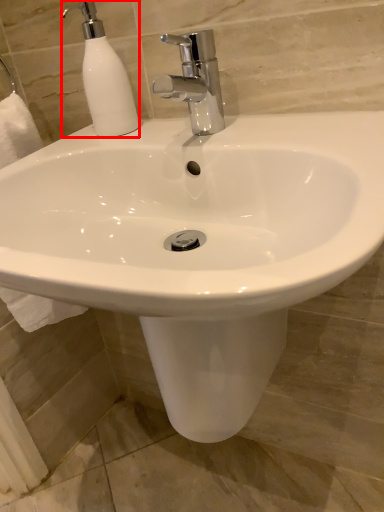
Question: Considering the relative positions of soap dispenser (annotated by the red box) and tap in the image provided, where is soap dispenser (annotated by the red box) located with respect to the staircase?

Choices:
 (A) right
 (B) left

Answer: (B)